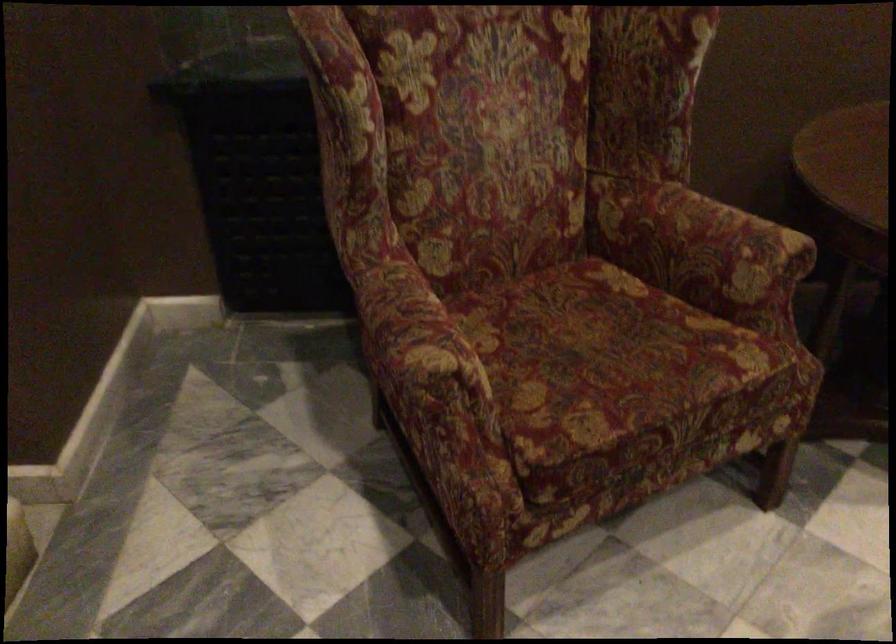
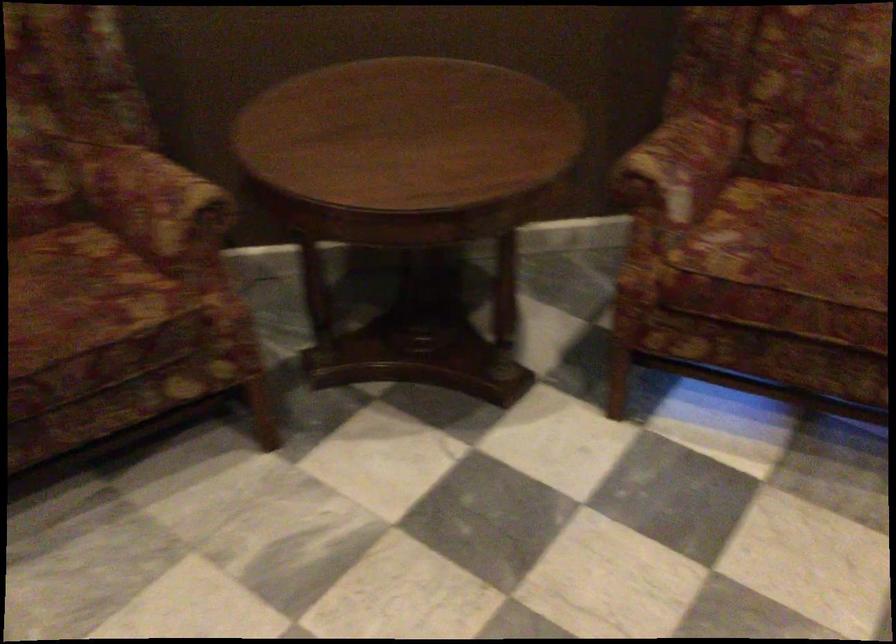
Find the pixel in the second image that matches point 724,245 in the first image.

(156, 204)